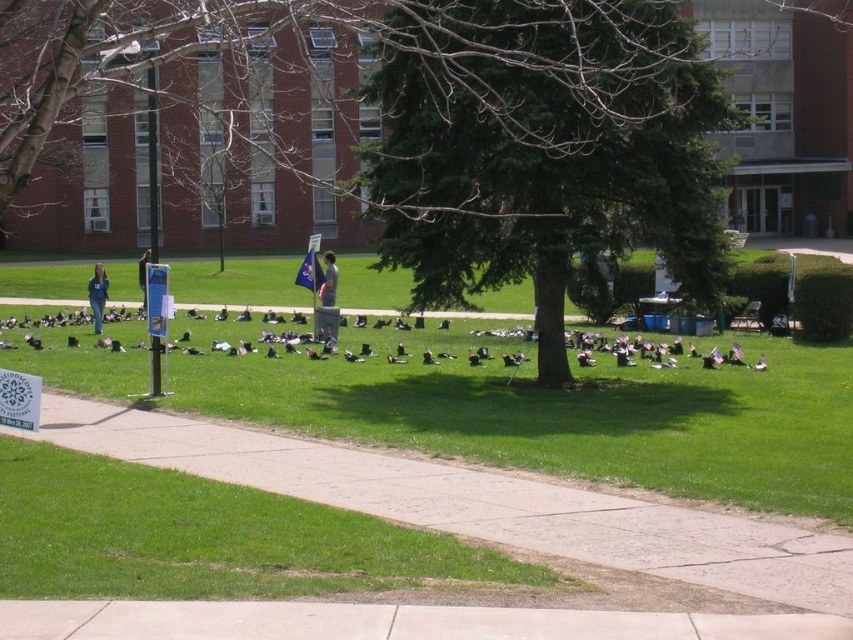
You are a photographer trying to capture a closeup of the green textured tree at center without the black matte shoes at center blocking the view. Can you do this?

The green textured tree at center is thinner than the black matte shoes at center, so it might be possible to position yourself to avoid the shoes blocking the tree if the tree is narrower. However, the exact feasibility depends on the distance between them and their placement in the scene.

You are a photographer standing at the edge of the grassy area. You want to take a photo that includes both the green textured tree at center and the black matte shoes at center. Which object should you focus on first to ensure both are in sharp focus?

The green textured tree at center is closer to the viewer than the black matte shoes at center. To ensure both are in sharp focus, you should focus on the green textured tree at center first.